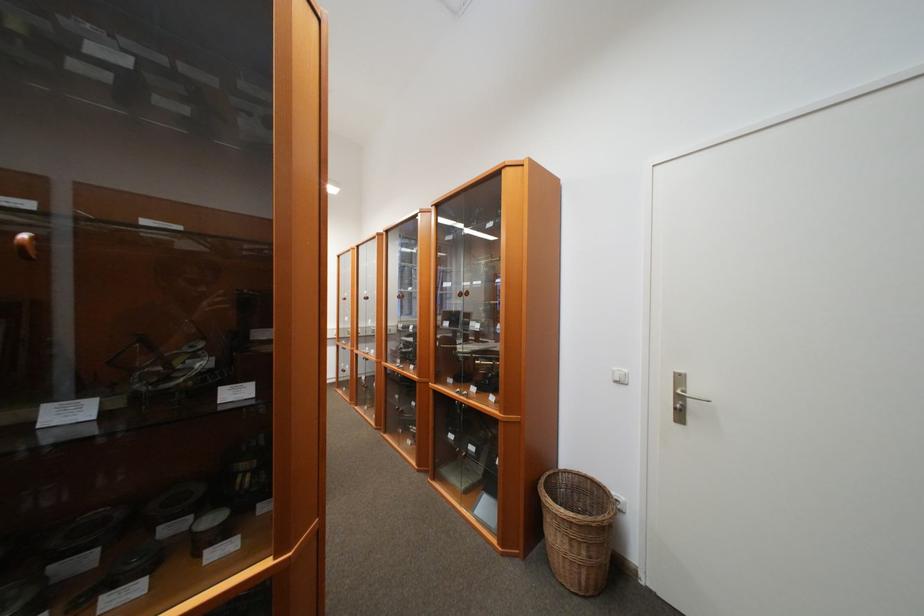
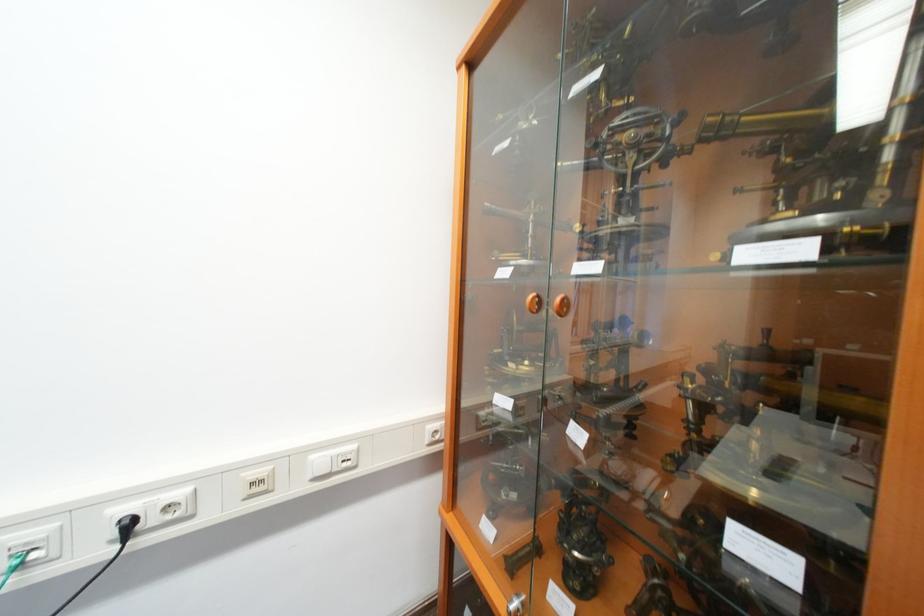
What movement of the cameraman would produce the second image?

The cameraman moved toward left, forward.